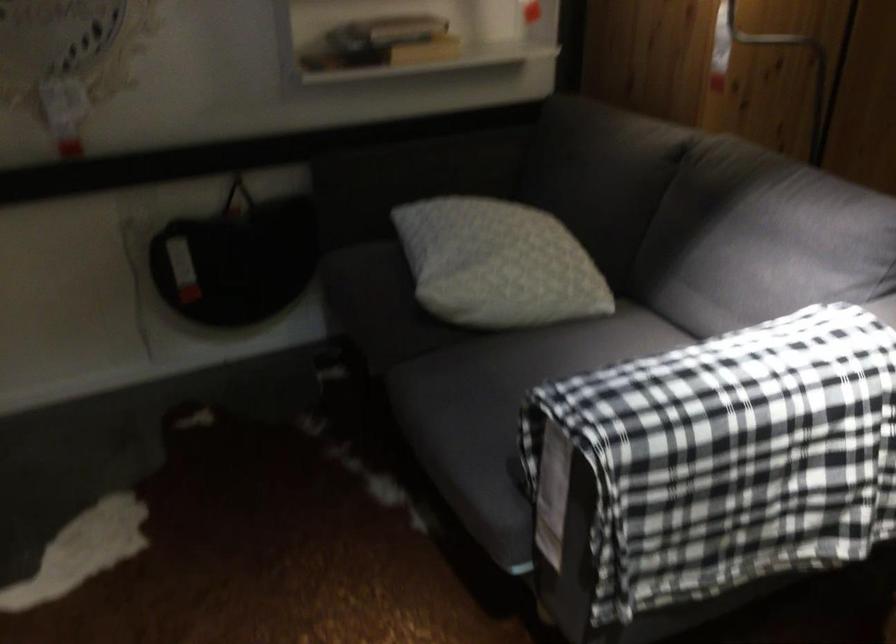
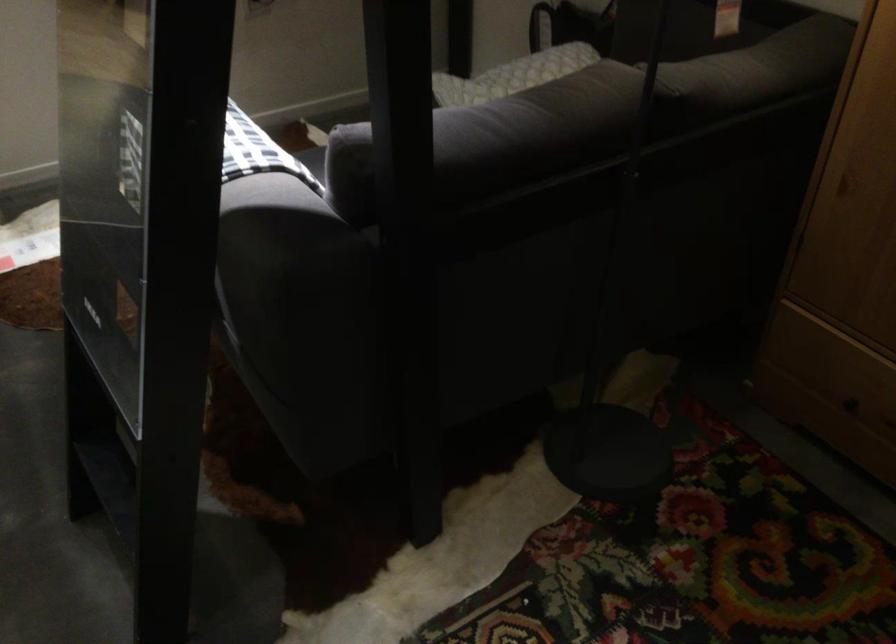
Find the pixel in the second image that matches the point at 497,228 in the first image.

(528, 68)